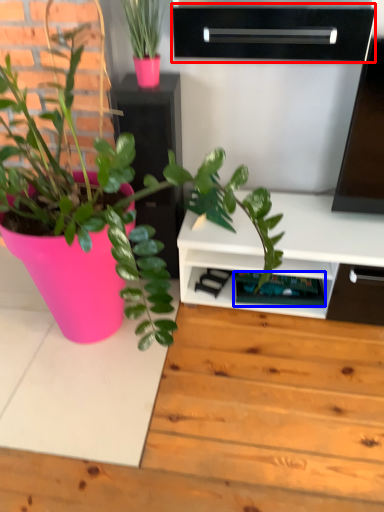
Question: Which point is closer to the camera, shelf (highlighted by a red box) or shelf (highlighted by a blue box)?

Choices:
 (A) shelf
 (B) shelf

Answer: (A)